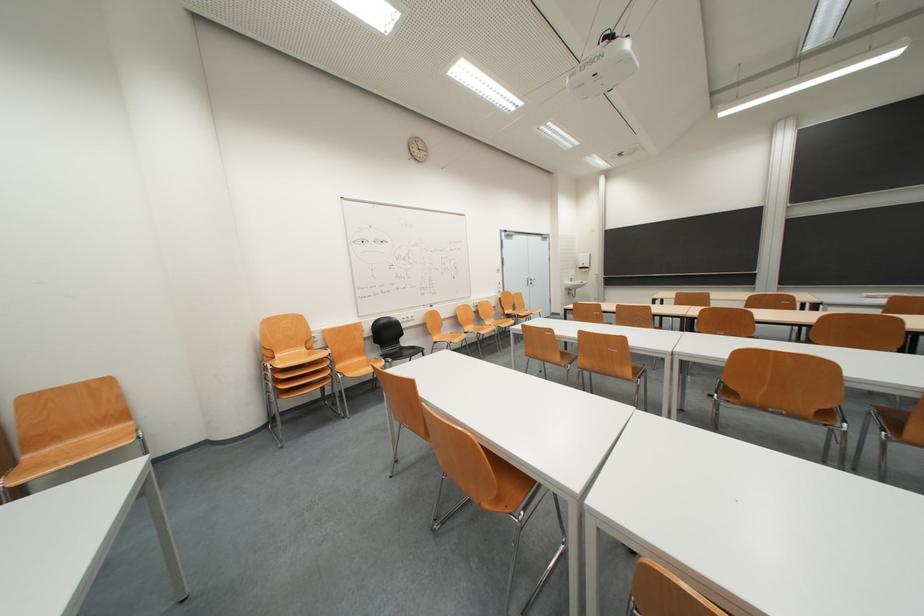
I want to click on metal door handle, so click(x=529, y=281).